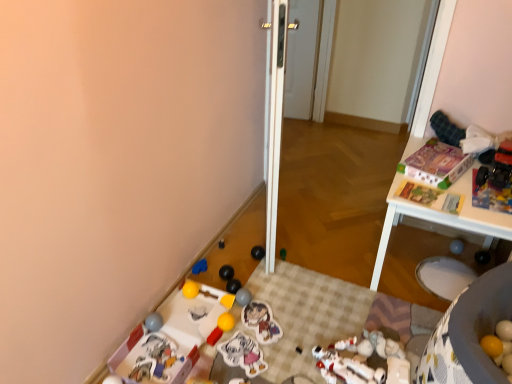
In order to click on vacant space to the left of matte plastic sticker at center, marked as the seventh toy in a right-to-left arrangement in this screenshot , I will do `click(216, 321)`.